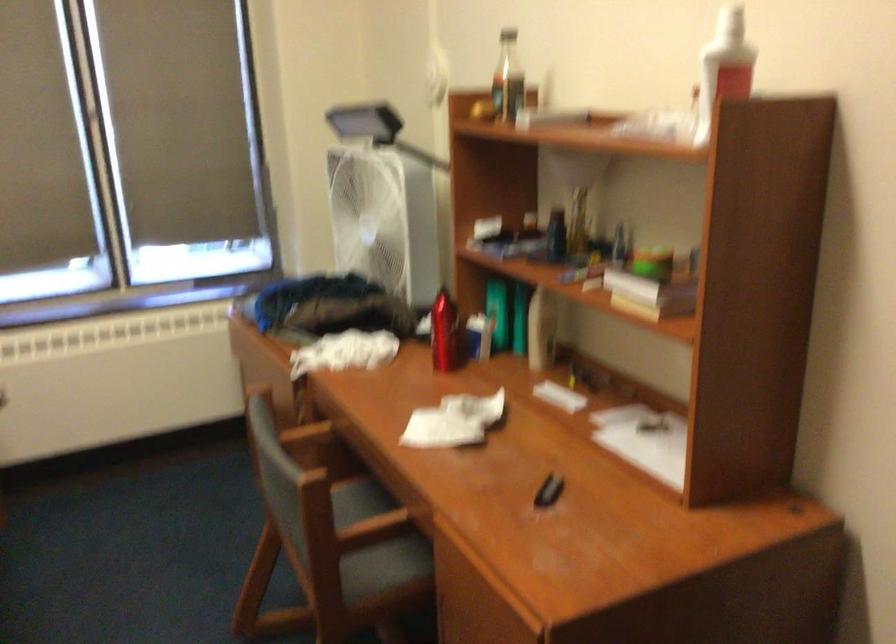
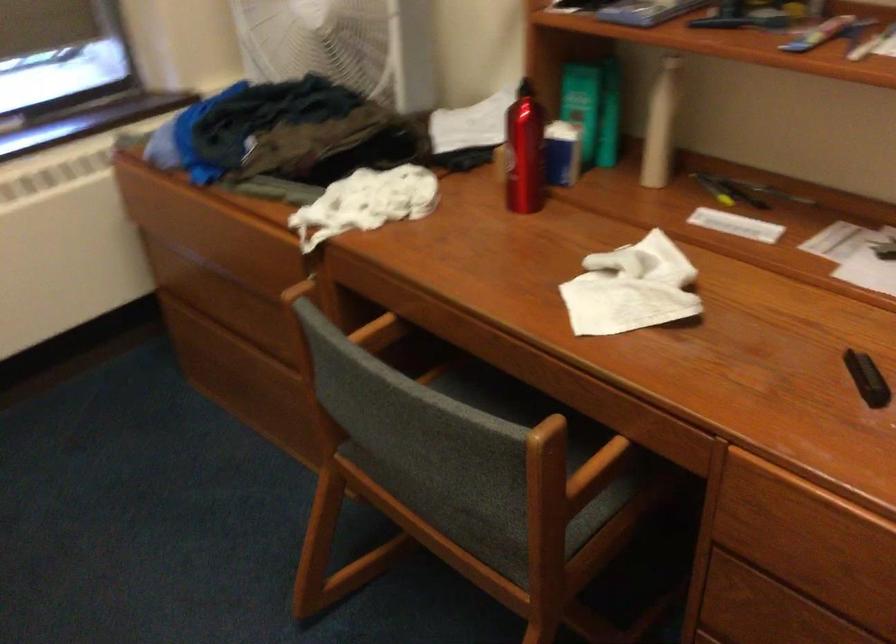
Where in the second image is the point corresponding to [302,542] from the first image?

(488, 509)